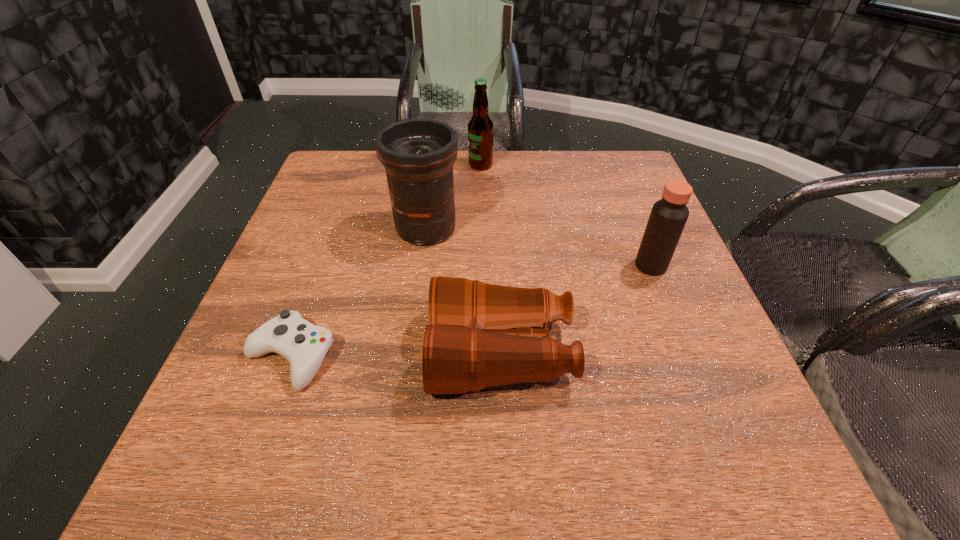
You are a GUI agent. You are given a task and a screenshot of the screen. Output one action in this format:
    pyautogui.click(x=<x>, y=<y>)
    Task: Click on the free point at the near edge
    The height and width of the screenshot is (540, 960).
    Given the screenshot: What is the action you would take?
    pyautogui.click(x=612, y=442)

In the image, there is a desktop. Identify the location of free space at the left edge. (217, 389).

The width and height of the screenshot is (960, 540). I want to click on vacant space at the right edge, so click(647, 225).

This screenshot has height=540, width=960. Identify the location of vacant space at the far right corner of the desktop. (614, 189).

You are a GUI agent. You are given a task and a screenshot of the screen. Output one action in this format:
    pyautogui.click(x=<x>, y=<y>)
    Task: Click on the vacant area at the near right corner of the desktop
    This screenshot has height=540, width=960.
    Given the screenshot: What is the action you would take?
    pyautogui.click(x=757, y=457)

Locate an element on the screen. vacant space in between the rightmost object and the fourth tallest object is located at coordinates (576, 309).

At what (x,y) coordinates should I click in order to perform the action: click on free area in between the third tallest object and the fourth tallest object. Please return your answer as a coordinate pair (x, y). The height and width of the screenshot is (540, 960). Looking at the image, I should click on (576, 309).

Find the location of a particular element. free space between the shortest object and the telephoto lens is located at coordinates (358, 293).

You are a GUI agent. You are given a task and a screenshot of the screen. Output one action in this format:
    pyautogui.click(x=<x>, y=<y>)
    Task: Click on the blank region between the vinegar and the beer bottle
    The image size is (960, 540).
    Given the screenshot: What is the action you would take?
    pyautogui.click(x=565, y=215)

The image size is (960, 540). Find the location of `vacant area that lies between the third farthest object and the farthest object`. vacant area that lies between the third farthest object and the farthest object is located at coordinates (565, 215).